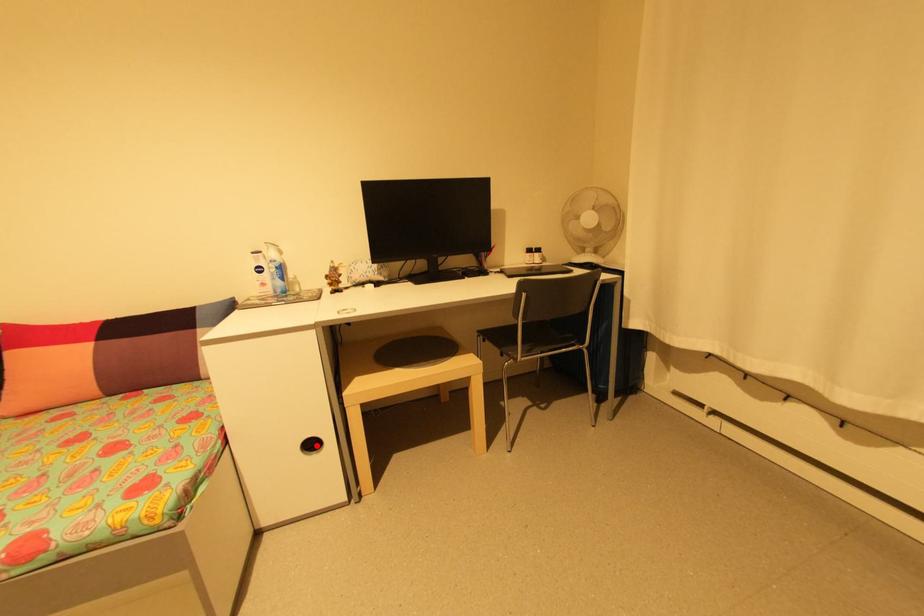
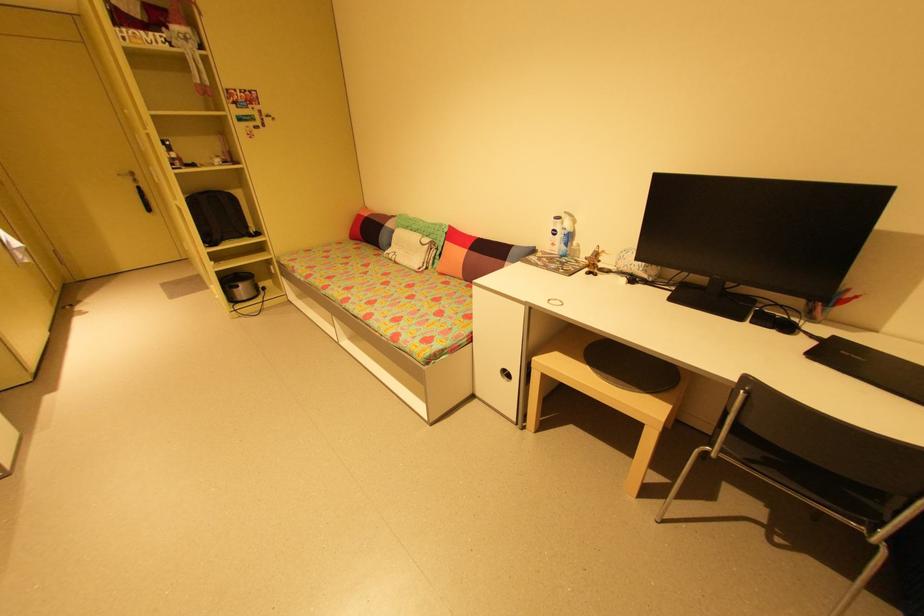
Where in the second image is the point corresponding to the highlighted location from the first image?

(512, 375)